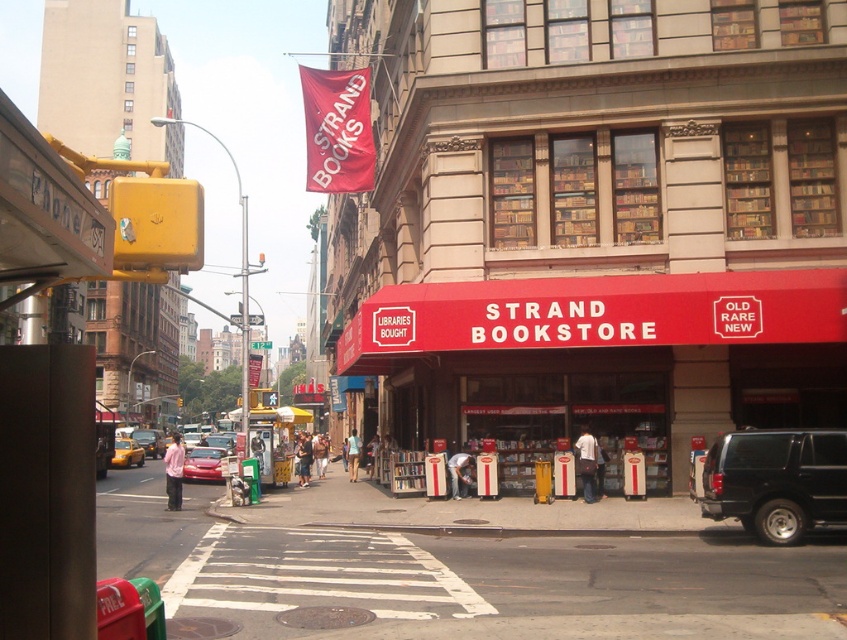
You are standing in front of The Strand Bookstore and see a point at coordinates (599, 312). According to the image, where is this point located?

The point is located on the matte red awning at center.

You are a photographer standing on the sidewalk in front of The Strand Bookstore. You want to capture both the red matte awning at center and the yellow matte taxi cab at left in a single photo. Given that your camera can only focus on objects within a 5 meter width, can you fit both objects in the frame without moving your position?

The red matte awning at center is wider than the yellow matte taxi cab at left. Since the camera can focus on objects within a 5 meter width, and the awning is the wider object, it depends on the combined width of both objects. However, since the awning is wider than the taxi, but the total width may still be under 5 meters, it is possible to fit both in the frame without moving.

You are a pedestrian standing in front of The Strand Bookstore and want to cross the street. There is a yellow matte taxi cab at left and a metallic red car at center. Which vehicle is closer to the bookstore entrance?

The metallic red car at center is closer to the bookstore entrance because the yellow matte taxi cab at left is to the right of it, meaning the metallic red car is positioned between the entrance and the taxi.